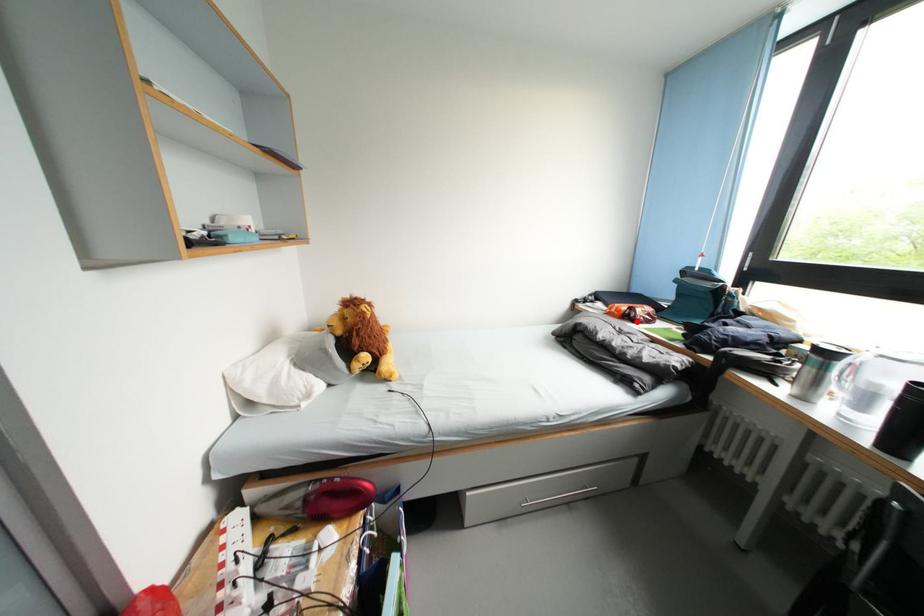
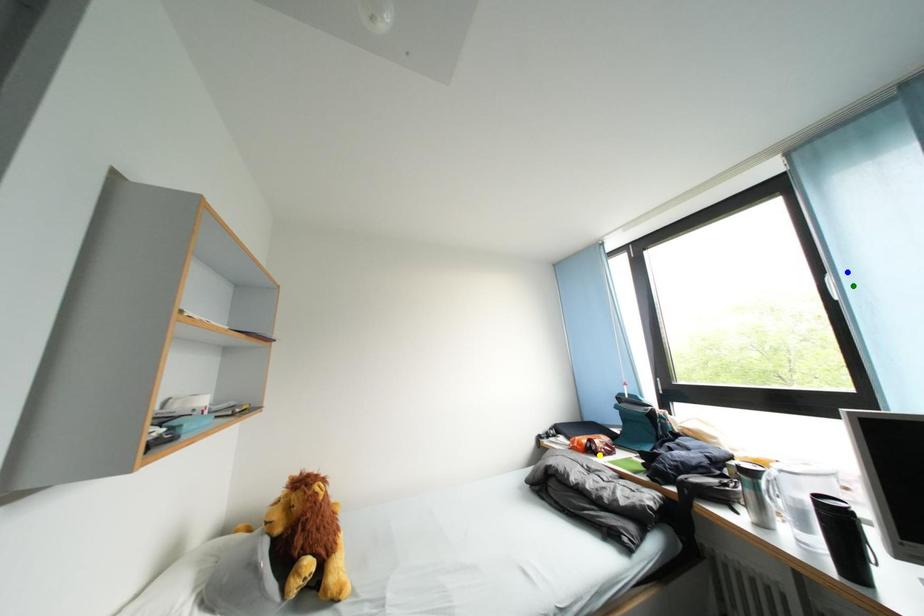
Question: I am providing you with two images of the same scene from different viewpoints. A red point is marked on the first image. You are given multiple points on the second image. Which mark in image 2 goes with the point in image 1?

Choices:
 (A) green point
 (B) blue point
 (C) yellow point

Answer: (C)